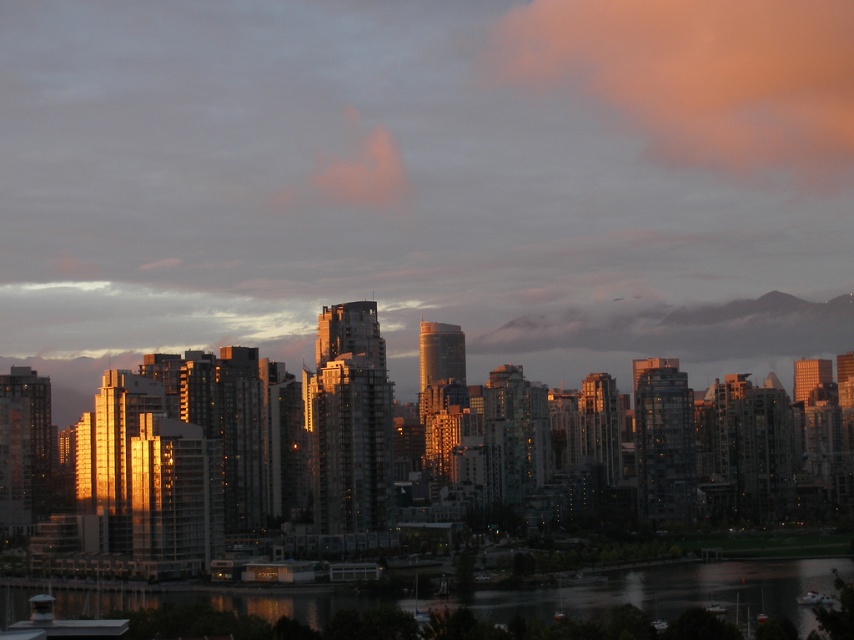
Question: Which point is farther to the camera?

Choices:
 (A) [623, 26]
 (B) [243, 593]

Answer: (A)

Question: Which point is closer to the camera?

Choices:
 (A) (752, 36)
 (B) (782, 614)

Answer: (B)

Question: Is pink fluffy cloud at upper center above reflective glass water at lower center?

Choices:
 (A) no
 (B) yes

Answer: (B)

Question: Can you confirm if pink fluffy cloud at upper center is positioned to the right of reflective glass water at lower center?

Choices:
 (A) yes
 (B) no

Answer: (A)

Question: Can you confirm if pink fluffy cloud at upper center is positioned above reflective glass water at lower center?

Choices:
 (A) no
 (B) yes

Answer: (B)